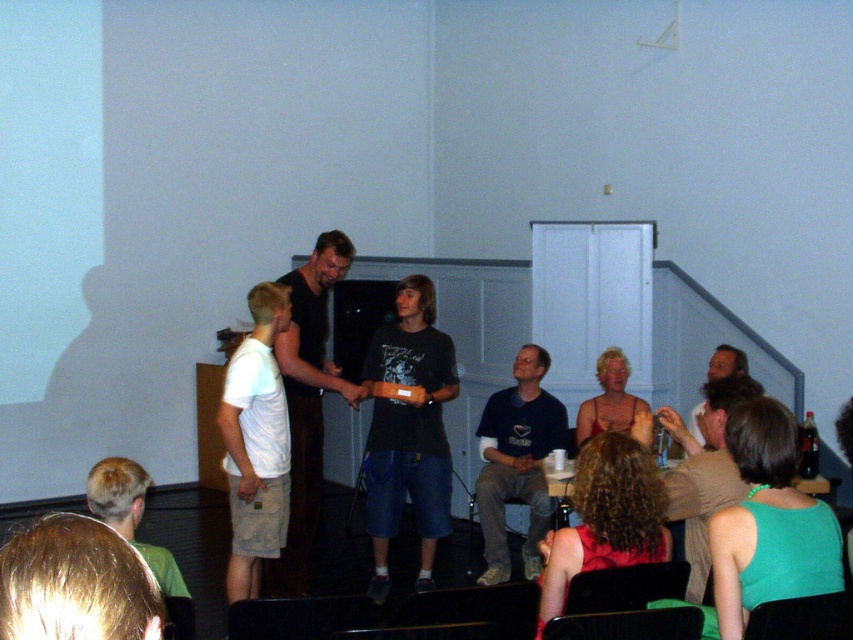
At what (x,y) coordinates should I click in order to perform the action: click on white cotton t-shirt at center. Please return your answer as a coordinate pair (x, y). Looking at the image, I should click on (256, 444).

Based on the photo, who is more forward, (x=276, y=305) or (x=328, y=248)?

Point (x=276, y=305)

Locate an element on the screen. Image resolution: width=853 pixels, height=640 pixels. white cotton t-shirt at center is located at coordinates (256, 444).

Can you confirm if blonde hair at lower left is shorter than short brown hair at lower left?

Correct, blonde hair at lower left is not as tall as short brown hair at lower left.

Between point (50, 538) and point (126, 531), which one is positioned in front?

Point (50, 538)

You are a GUI agent. You are given a task and a screenshot of the screen. Output one action in this format:
    pyautogui.click(x=<x>, y=<y>)
    Task: Click on the blonde hair at lower left
    
    Given the screenshot: What is the action you would take?
    pyautogui.click(x=76, y=582)

Is curly hair at lower center smaller than short brown hair at lower left?

Actually, curly hair at lower center might be larger than short brown hair at lower left.

Between point (560, 600) and point (86, 480), which one is positioned in front?

Point (560, 600) is in front.

Where is `curly hair at lower center`? curly hair at lower center is located at coordinates (605, 518).